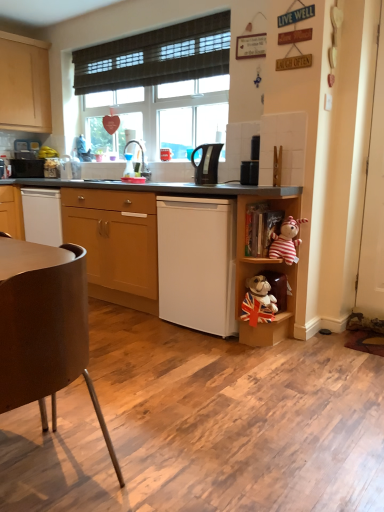
Identify the location of black plastic kettle at center. (207, 163).

The height and width of the screenshot is (512, 384). I want to click on black plastic speaker at center, the first appliance from the right, so click(x=249, y=172).

Measure the distance between brown woven curtain at upper center and camera.

A distance of 9.67 feet exists between brown woven curtain at upper center and camera.

Where is `transparent plastic sink at center, the second appliance viewed from the right`? transparent plastic sink at center, the second appliance viewed from the right is located at coordinates (142, 159).

Locate an element on the screen. white plastic shelf at lower right, the 3th shelf viewed from the top is located at coordinates (264, 297).

Considering the sizes of objects black plastic kettle at center and brown woven curtain at upper center in the image provided, who is bigger, black plastic kettle at center or brown woven curtain at upper center?

With larger size is brown woven curtain at upper center.

Considering the sizes of black plastic kettle at center and brown woven curtain at upper center in the image, is black plastic kettle at center wider or thinner than brown woven curtain at upper center?

Considering their sizes, black plastic kettle at center looks broader than brown woven curtain at upper center.

Is point (202, 184) less distant than point (145, 36)?

Yes, point (202, 184) is closer to viewer.

Is black plastic kettle at center completely or partially outside of brown woven curtain at upper center?

That's correct, black plastic kettle at center is outside of brown woven curtain at upper center.

Between point (100, 64) and point (206, 205), which one is positioned behind?

Point (100, 64)

From a real-world perspective, which is physically below, brown woven curtain at upper center or white matte dishwasher at center?

white matte dishwasher at center, from a real-world perspective.

Which is more to the right, brown woven curtain at upper center or white matte dishwasher at center?

white matte dishwasher at center.

Is transparent plastic sink at center, positioned as the 2th appliance in left-to-right order, taller than white matte dishwasher at center?

No.

Is white matte dishwasher at center a part of transparent plastic sink at center, the second appliance viewed from the right?

That's incorrect, white matte dishwasher at center is not inside transparent plastic sink at center, the second appliance viewed from the right.

Is transparent plastic sink at center, positioned as the 2th appliance in left-to-right order, beside white matte dishwasher at center?

No, transparent plastic sink at center, positioned as the 2th appliance in left-to-right order, is not with white matte dishwasher at center.

Is wooden shelf at right, the second shelf from the bottom, positioned behind black plastic kettle at center?

No, it is not.

Looking at this image, from a real-world perspective, which is physically above, wooden shelf at right, acting as the second shelf starting from the top, or black plastic kettle at center?

In real-world perspective, black plastic kettle at center is above.

Does wooden shelf at right, acting as the second shelf starting from the top, have a lesser width compared to black plastic kettle at center?

Incorrect, the width of wooden shelf at right, acting as the second shelf starting from the top, is not less than that of black plastic kettle at center.

Does wooden shelf at right, acting as the second shelf starting from the top, touch black plastic kettle at center?

No, wooden shelf at right, acting as the second shelf starting from the top, is not in contact with black plastic kettle at center.

In terms of width, does matte wood cabinet at center look wider or thinner when compared to white glossy kettle at upper center, the first appliance from the back?

Clearly, matte wood cabinet at center has more width compared to white glossy kettle at upper center, the first appliance from the back.

Could you measure the distance between matte wood cabinet at center and white glossy kettle at upper center, arranged as the first appliance when viewed from the left?

matte wood cabinet at center and white glossy kettle at upper center, arranged as the first appliance when viewed from the left, are 3.96 feet apart from each other.

From the image's perspective, which is below, matte wood cabinet at center or white glossy kettle at upper center, the first appliance from the back?

matte wood cabinet at center.

Between matte wood cabinet at center and white glossy kettle at upper center, arranged as the first appliance when viewed from the left, which one has larger size?

Bigger between the two is matte wood cabinet at center.

Is striped fabric monkey at right bigger or smaller than wooden bookshelf at center-right, the 3th shelf positioned from the bottom?

In the image, striped fabric monkey at right appears to be smaller than wooden bookshelf at center-right, the 3th shelf positioned from the bottom.

You are a GUI agent. You are given a task and a screenshot of the screen. Output one action in this format:
    pyautogui.click(x=<x>, y=<y>)
    Task: Click on the toy beneath the wooden bookshelf at center-right, arranged as the first shelf when viewed from the top (from a real-world perspective)
    
    Given the screenshot: What is the action you would take?
    pyautogui.click(x=286, y=241)

From the image's perspective, which is below, striped fabric monkey at right or wooden bookshelf at center-right, the 3th shelf positioned from the bottom?

striped fabric monkey at right is shown below in the image.

Who is shorter, striped fabric monkey at right or wooden bookshelf at center-right, arranged as the first shelf when viewed from the top?

striped fabric monkey at right is shorter.

Is point (265, 301) in front of point (38, 399)?

No, (265, 301) is behind (38, 399).

In the image, is white plastic shelf at lower right, marked as the first shelf in a bottom-to-top arrangement, on the left side or the right side of brown matte chair at lower left?

white plastic shelf at lower right, marked as the first shelf in a bottom-to-top arrangement, is to the right of brown matte chair at lower left.

From a real-world perspective, which is physically below, white plastic shelf at lower right, the 3th shelf viewed from the top, or brown matte chair at lower left?

white plastic shelf at lower right, the 3th shelf viewed from the top.

In the image, there is a black plastic kettle at center. At what (x,y) coordinates should I click in order to perform the action: click on curtain above it (from the image's perspective). Please return your answer as a coordinate pair (x, y). This screenshot has height=512, width=384. Looking at the image, I should click on (156, 56).

Where is `dish washer that is below the brown woven curtain at upper center (from the image's perspective)`? This screenshot has width=384, height=512. dish washer that is below the brown woven curtain at upper center (from the image's perspective) is located at coordinates (197, 263).

Which object lies further to the anchor point transparent plastic sink at center, the second appliance viewed from the right, matte wood cabinet at center or brown woven curtain at upper center?

The object further to transparent plastic sink at center, the second appliance viewed from the right, is brown woven curtain at upper center.

Considering their positions, is brown woven curtain at upper center positioned closer to white matte dishwasher at center than white glossy kettle at upper center, the 3th appliance viewed from the right?

brown woven curtain at upper center lies closer to white matte dishwasher at center than the other object.

Based on the photo, looking at the image, which one is located closer to striped fabric monkey at right, white matte dishwasher at center or wooden bookshelf at center-right, arranged as the first shelf when viewed from the top?

wooden bookshelf at center-right, arranged as the first shelf when viewed from the top, lies closer to striped fabric monkey at right than the other object.

Based on their spatial positions, is striped fabric monkey at right or transparent plastic sink at center, positioned as the 2th appliance in left-to-right order, further from white matte dishwasher at center?

The object further to white matte dishwasher at center is transparent plastic sink at center, positioned as the 2th appliance in left-to-right order.

Estimate the real-world distances between objects in this image. Which object is further from white plastic shelf at lower right, marked as the first shelf in a bottom-to-top arrangement, brown woven curtain at upper center or white matte dishwasher at center?

The object further to white plastic shelf at lower right, marked as the first shelf in a bottom-to-top arrangement, is brown woven curtain at upper center.

From the image, which object appears to be nearer to white glossy kettle at upper center, arranged as the first appliance when viewed from the left, black plastic speaker at center, which ranks as the third appliance in back-to-front order, or white plastic shelf at lower right, marked as the first shelf in a bottom-to-top arrangement?

Based on the image, black plastic speaker at center, which ranks as the third appliance in back-to-front order, appears to be nearer to white glossy kettle at upper center, arranged as the first appliance when viewed from the left.

Looking at the image, which one is located further to white glossy kettle at upper center, the third appliance when ordered from front to back, matte wood cabinet at center or transparent plastic sink at center, positioned as the 2th appliance in left-to-right order?

matte wood cabinet at center is positioned further to the anchor white glossy kettle at upper center, the third appliance when ordered from front to back.

Estimate the real-world distances between objects in this image. Which object is further from wooden bookshelf at center-right, arranged as the first shelf when viewed from the top, white matte dishwasher at center or black plastic speaker at center, which ranks as the third appliance in back-to-front order?

white matte dishwasher at center is further to wooden bookshelf at center-right, arranged as the first shelf when viewed from the top.

At what (x,y) coordinates should I click in order to perform the action: click on cabinetry between wooden shelf at right, acting as the second shelf starting from the top, and transparent plastic sink at center, the second appliance viewed from the right, along the z-axis. Please return your answer as a coordinate pair (x, y). The width and height of the screenshot is (384, 512). Looking at the image, I should click on (115, 243).

This screenshot has width=384, height=512. Find the location of `appliance located between wooden shelf at right, acting as the second shelf starting from the top, and transparent plastic sink at center, the second appliance viewed from the right, in the depth direction`. appliance located between wooden shelf at right, acting as the second shelf starting from the top, and transparent plastic sink at center, the second appliance viewed from the right, in the depth direction is located at coordinates (249, 172).

You are a GUI agent. You are given a task and a screenshot of the screen. Output one action in this format:
    pyautogui.click(x=<x>, y=<y>)
    Task: Click on the kitchen appliance located between matte wood cabinet at center and wooden bookshelf at center-right, arranged as the first shelf when viewed from the top, in the left-right direction
    
    Given the screenshot: What is the action you would take?
    pyautogui.click(x=207, y=163)

Find the location of a particular element. This screenshot has height=512, width=384. cabinetry between white matte dishwasher at center and white glossy kettle at upper center, the third appliance when ordered from front to back, along the z-axis is located at coordinates (115, 243).